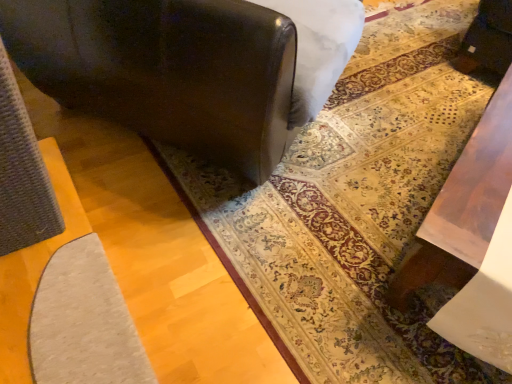
Question: Looking at their shapes, would you say matte black sofa at center is wider or thinner than matte gray rug at center?

Choices:
 (A) wide
 (B) thin

Answer: (B)

Question: In the image, is matte black sofa at center positioned in front of or behind matte gray rug at center?

Choices:
 (A) front
 (B) behind

Answer: (A)

Question: Based on their positions, is matte black sofa at center located to the left or right of matte gray rug at center?

Choices:
 (A) left
 (B) right

Answer: (A)

Question: Would you say matte gray rug at center is to the left or to the right of matte black sofa at center in the picture?

Choices:
 (A) left
 (B) right

Answer: (B)

Question: Relative to matte black sofa at center, is matte gray rug at center in front or behind?

Choices:
 (A) behind
 (B) front

Answer: (A)

Question: Would you say matte gray rug at center is inside or outside matte black sofa at center?

Choices:
 (A) inside
 (B) outside

Answer: (B)

Question: Is matte gray rug at center taller or shorter than matte black sofa at center?

Choices:
 (A) tall
 (B) short

Answer: (B)